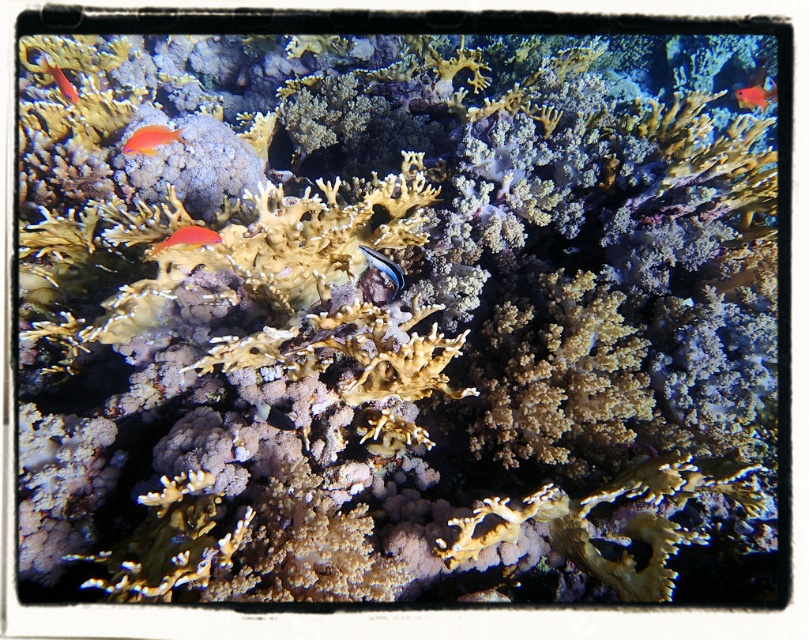
Between bright orange coral at upper left and shiny red fish at upper right, which one appears on the right side from the viewer's perspective?

Positioned to the right is shiny red fish at upper right.

Is bright orange coral at upper left further to camera compared to shiny red fish at upper right?

No.

Which is in front, point (136, 129) or point (761, 81)?

Point (136, 129) is in front.

Locate an element on the screen. bright orange coral at upper left is located at coordinates (150, 138).

Does point (212, 237) come behind point (755, 97)?

No, (212, 237) is closer to viewer.

Between point (198, 237) and point (773, 92), which one is positioned in front?

Positioned in front is point (198, 237).

The image size is (809, 640). What do you see at coordinates (187, 237) in the screenshot?
I see `shiny orange fish at left` at bounding box center [187, 237].

Image resolution: width=809 pixels, height=640 pixels. Find the location of `shiny orange fish at left`. shiny orange fish at left is located at coordinates (187, 237).

Can you confirm if shiny red fish at upper right is positioned above shiny orange fish at upper left?

Yes.

Which is more to the right, shiny red fish at upper right or shiny orange fish at upper left?

From the viewer's perspective, shiny red fish at upper right appears more on the right side.

This screenshot has height=640, width=809. What are the coordinates of `shiny red fish at upper right` in the screenshot? It's located at (755, 96).